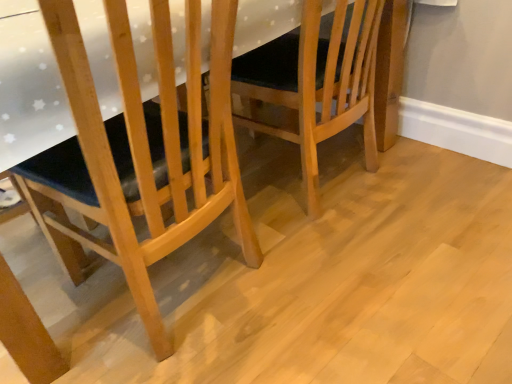
Find the location of a particular element. Image resolution: width=512 pixels, height=384 pixels. vacant space to the right of light brown wooden chair at center, which is the 1th chair from right to left is located at coordinates (446, 180).